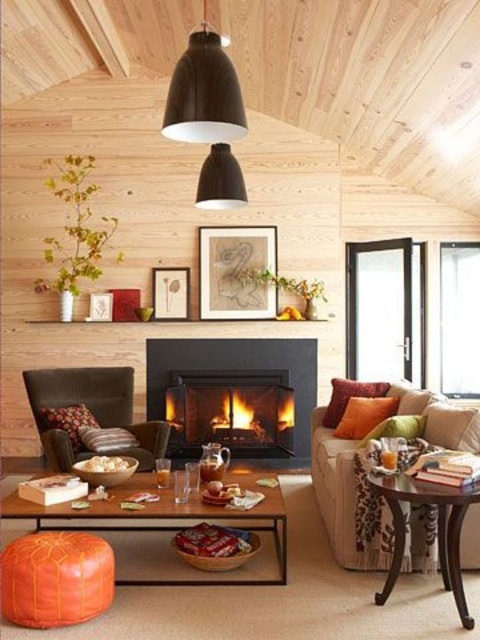
You are planning to place a new coffee table in the living room. The velvet beige couch at center is currently occupying space. Will the dark brown wooden side table at right fit in the remaining space next to the couch?

The velvet beige couch at center is larger than the dark brown wooden side table at right. Since the couch is bigger, there should be enough space left for the side table to fit next to it.

You are standing in the living room and want to hang a picture between the two points labeled as point (359,396) and point (479,413). Which point should the picture be placed closer to so it appears in front of the other?

The picture should be placed closer to point (479,413) because point (359,396) is behind it, making the latter more visible in front.